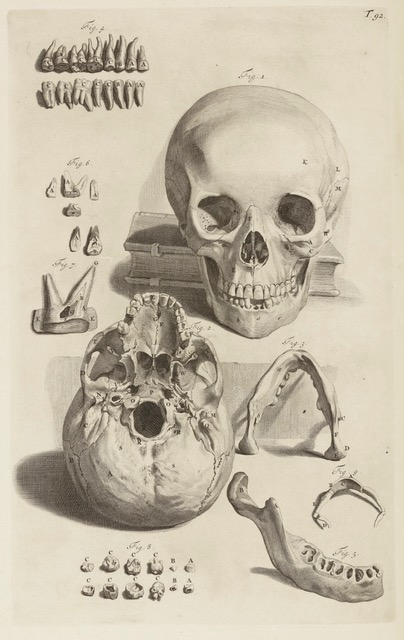
In order to click on book in this screenshot , I will do `click(172, 236)`, `click(326, 285)`.